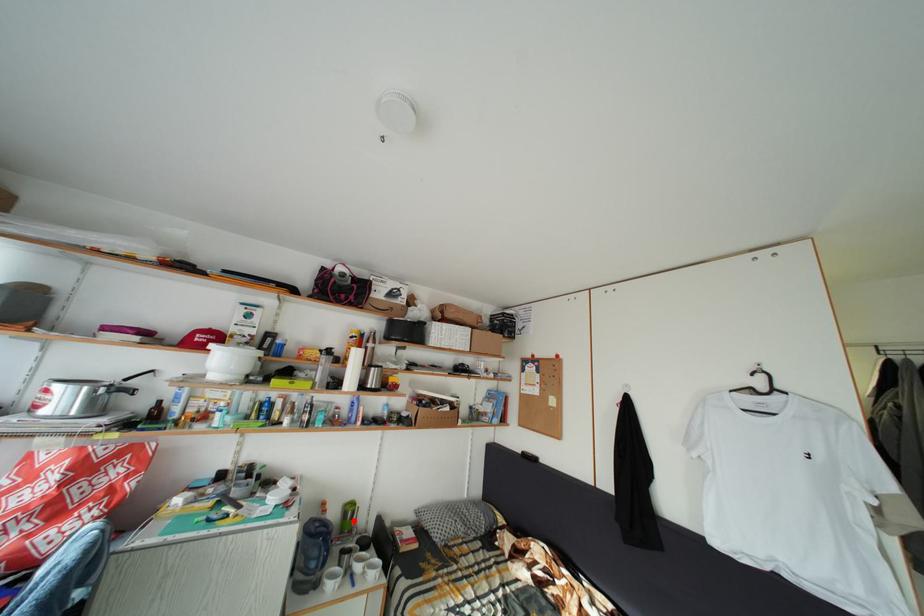
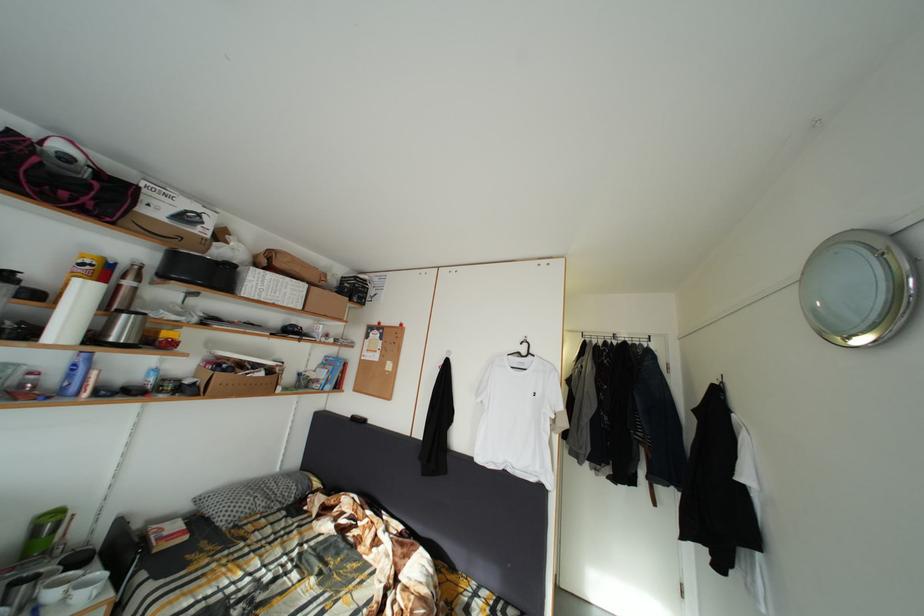
Question: I am providing you with two images of the same scene from different viewpoints. In image1, a red point is highlighted. Considering the same 3D point in image2, which of the following is correct?

Choices:
 (A) It is closer
 (B) It is farther

Answer: (A)